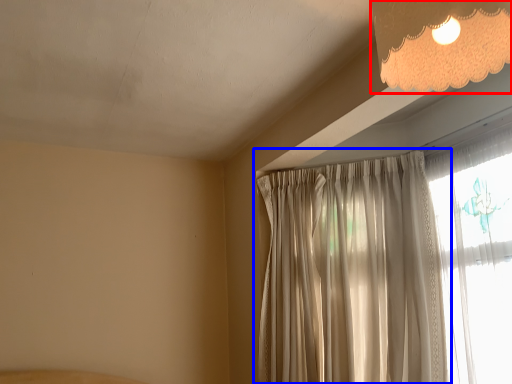
Question: Which point is further to the camera, lamp (highlighted by a red box) or curtain (highlighted by a blue box)?

Choices:
 (A) lamp
 (B) curtain

Answer: (B)